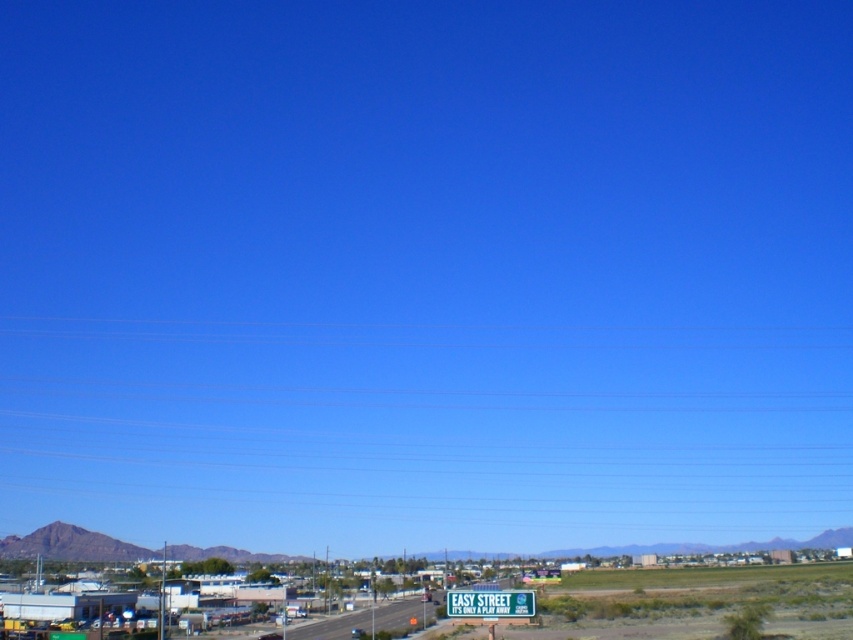
Question: Which point is farther to the camera?

Choices:
 (A) smooth asphalt highway at center
 (B) green plastic sign at lower center

Answer: (A)

Question: Is smooth asphalt highway at center positioned behind green plastic sign at lower center?

Choices:
 (A) no
 (B) yes

Answer: (B)

Question: Can you confirm if smooth asphalt highway at center is thinner than green plastic sign at lower center?

Choices:
 (A) no
 (B) yes

Answer: (A)

Question: Observing the image, what is the correct spatial positioning of smooth asphalt highway at center in reference to green plastic sign at lower center?

Choices:
 (A) right
 (B) left

Answer: (B)

Question: Which point appears closest to the camera in this image?

Choices:
 (A) (387, 620)
 (B) (459, 598)

Answer: (B)